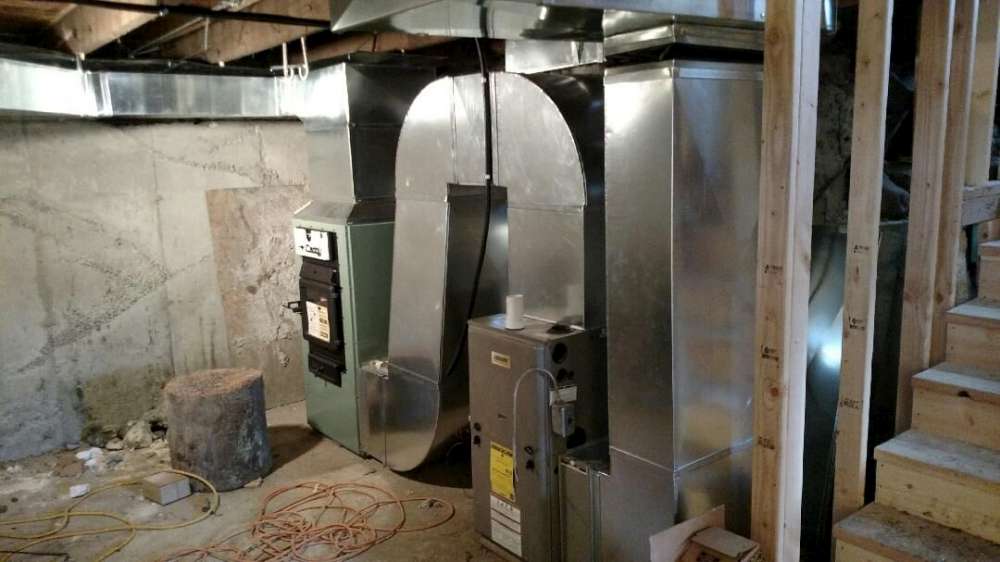
You are a GUI agent. You are given a task and a screenshot of the screen. Output one action in this format:
    pyautogui.click(x=<x>, y=<y>)
    Task: Click on the hanging black wire
    This screenshot has height=562, width=1000.
    Given the screenshot: What is the action you would take?
    pyautogui.click(x=487, y=140)